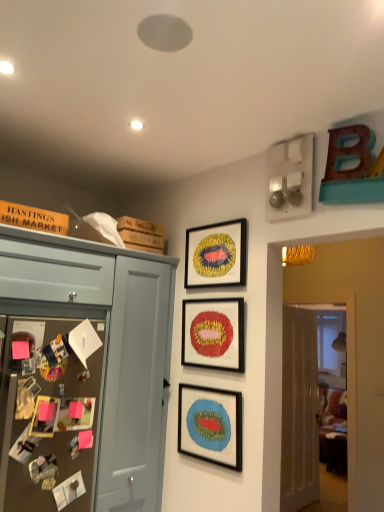
Question: Could you tell me if matte blue cabinet at left is facing brown textured bulletin board at left?

Choices:
 (A) no
 (B) yes

Answer: (A)

Question: Considering the relative sizes of matte blue cabinet at left and brown textured bulletin board at left in the image provided, is matte blue cabinet at left wider than brown textured bulletin board at left?

Choices:
 (A) yes
 (B) no

Answer: (A)

Question: Can we say matte blue cabinet at left lies outside brown textured bulletin board at left?

Choices:
 (A) yes
 (B) no

Answer: (A)

Question: From the image's perspective, would you say matte blue cabinet at left is positioned over brown textured bulletin board at left?

Choices:
 (A) no
 (B) yes

Answer: (A)

Question: Is matte blue cabinet at left far from brown textured bulletin board at left?

Choices:
 (A) yes
 (B) no

Answer: (B)

Question: Is matte blue cabinet at left positioned before brown textured bulletin board at left?

Choices:
 (A) yes
 (B) no

Answer: (B)

Question: From a real-world perspective, is white glossy door at right located beneath matte blue cabinet at left?

Choices:
 (A) yes
 (B) no

Answer: (A)

Question: Considering the relative sizes of white glossy door at right and matte blue cabinet at left in the image provided, is white glossy door at right thinner than matte blue cabinet at left?

Choices:
 (A) no
 (B) yes

Answer: (B)

Question: Is white glossy door at right to the left of matte blue cabinet at left from the viewer's perspective?

Choices:
 (A) yes
 (B) no

Answer: (B)

Question: Is white glossy door at right not inside matte blue cabinet at left?

Choices:
 (A) yes
 (B) no

Answer: (A)

Question: Does white glossy door at right have a lesser height compared to matte blue cabinet at left?

Choices:
 (A) no
 (B) yes

Answer: (A)

Question: Is white glossy door at right in front of matte blue cabinet at left?

Choices:
 (A) no
 (B) yes

Answer: (A)

Question: Can you confirm if white glossy door at right is shorter than matte red picture frame at center, which appears as the second picture frame when ordered from the bottom?

Choices:
 (A) yes
 (B) no

Answer: (B)